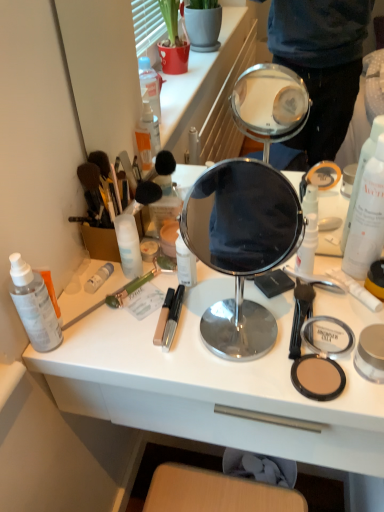
You are a GUI agent. You are given a task and a screenshot of the screen. Output one action in this format:
    pyautogui.click(x=<x>, y=<y>)
    Task: Click on the free space that is in between matte black compact at lower right and green plastic brush at lower left
    
    Given the screenshot: What is the action you would take?
    pyautogui.click(x=185, y=339)